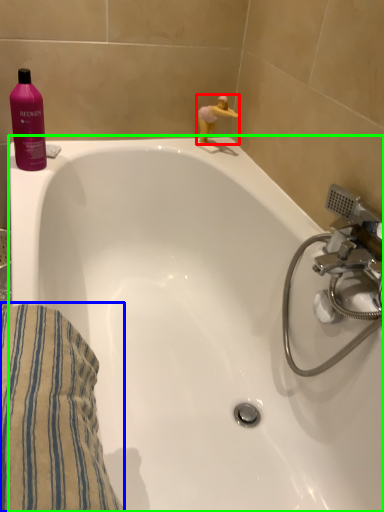
Question: Estimate the real-world distances between objects in this image. Which object is closer to miniature (highlighted by a red box), bath towel (highlighted by a blue box) or bathtub (highlighted by a green box)?

Choices:
 (A) bath towel
 (B) bathtub

Answer: (B)